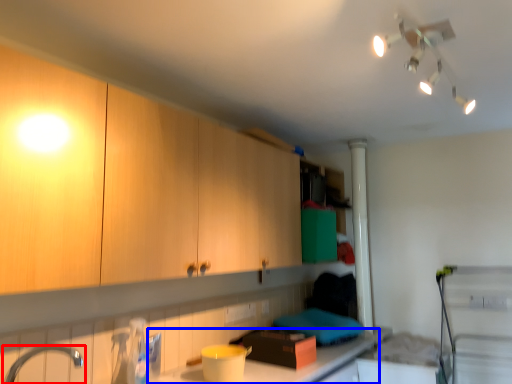
Question: Which of the following is the closest to the observer, tap (highlighted by a red box) or countertop (highlighted by a blue box)?

Choices:
 (A) tap
 (B) countertop

Answer: (A)